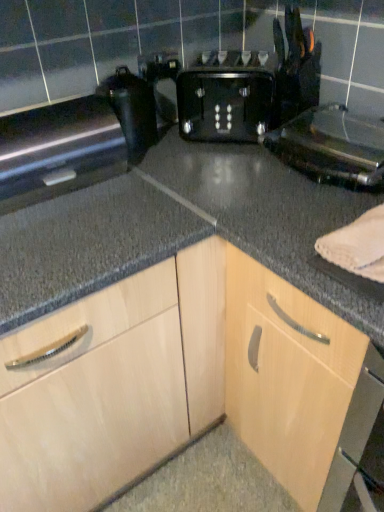
You are a GUI agent. You are given a task and a screenshot of the screen. Output one action in this format:
    pyautogui.click(x=<x>, y=<y>)
    Task: Click on the free space that is to the left of black plastic toaster at upper center, marked as the third appliance in a left-to-right arrangement
    This screenshot has height=512, width=384.
    Given the screenshot: What is the action you would take?
    pyautogui.click(x=232, y=183)